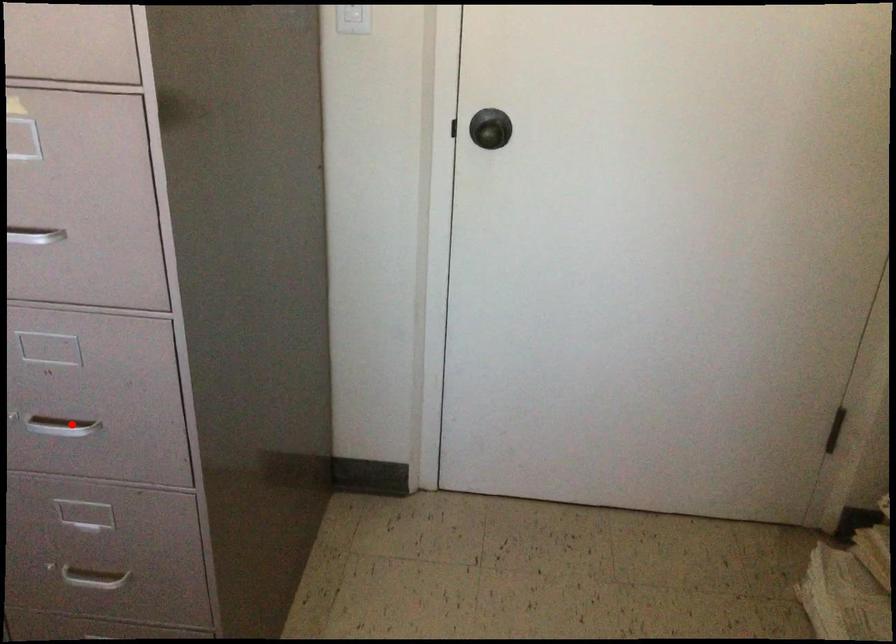
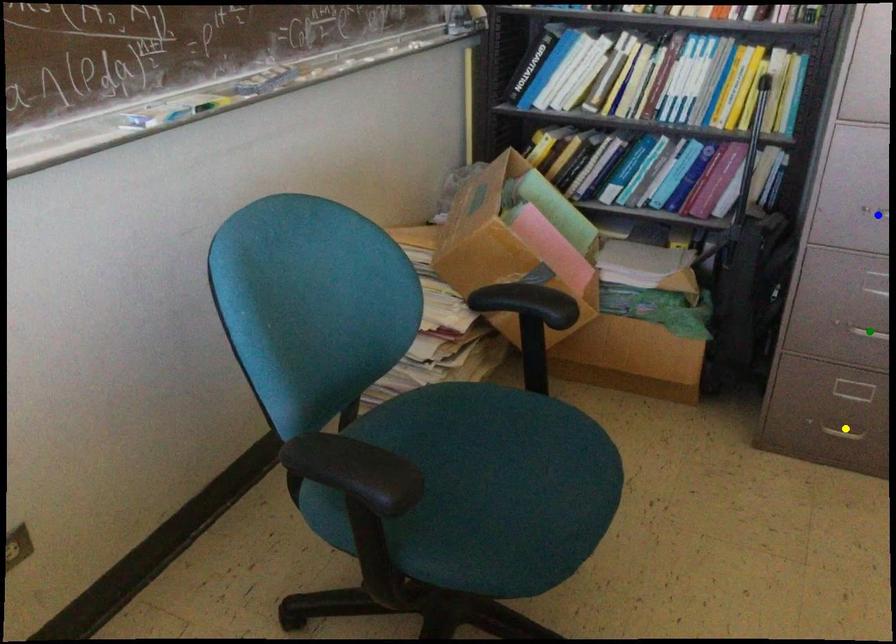
Question: I am providing you with two images of the same scene from different viewpoints. A red point is marked on the first image. You are given multiple points on the second image. Which point in image 2 represents the same 3d spot as the red point in image 1?

Choices:
 (A) yellow point
 (B) blue point
 (C) green point

Answer: (B)